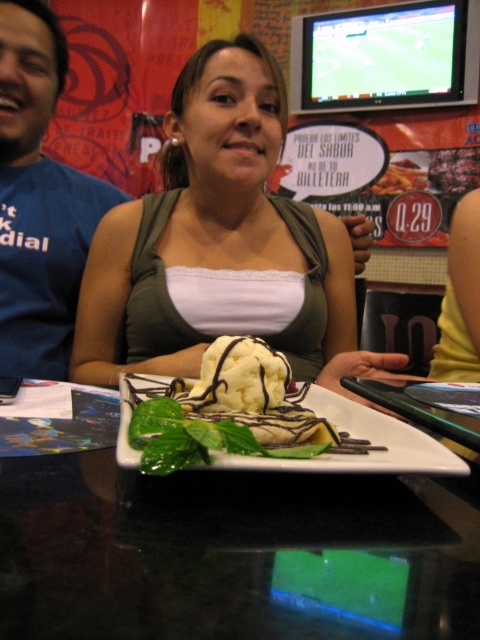
Question: From the image, what is the correct spatial relationship of matte green tank top at center in relation to blue fabric shirt at left?

Choices:
 (A) above
 (B) below

Answer: (B)

Question: Observing the image, what is the correct spatial positioning of matte green tank top at center in reference to blue fabric shirt at left?

Choices:
 (A) above
 (B) below

Answer: (B)

Question: Which point is farther from the camera taking this photo?

Choices:
 (A) (73, 214)
 (B) (235, 406)

Answer: (A)

Question: Among these points, which one is nearest to the camera?

Choices:
 (A) (267, 264)
 (B) (248, 417)
 (C) (284, 364)
 (D) (262, 580)

Answer: (D)

Question: In this image, where is matte green tank top at center located relative to blue fabric shirt at left?

Choices:
 (A) right
 (B) left

Answer: (A)

Question: Which point is closer to the camera?

Choices:
 (A) black glossy table at center
 (B) blue fabric shirt at left
 (C) matte green tank top at center

Answer: (A)